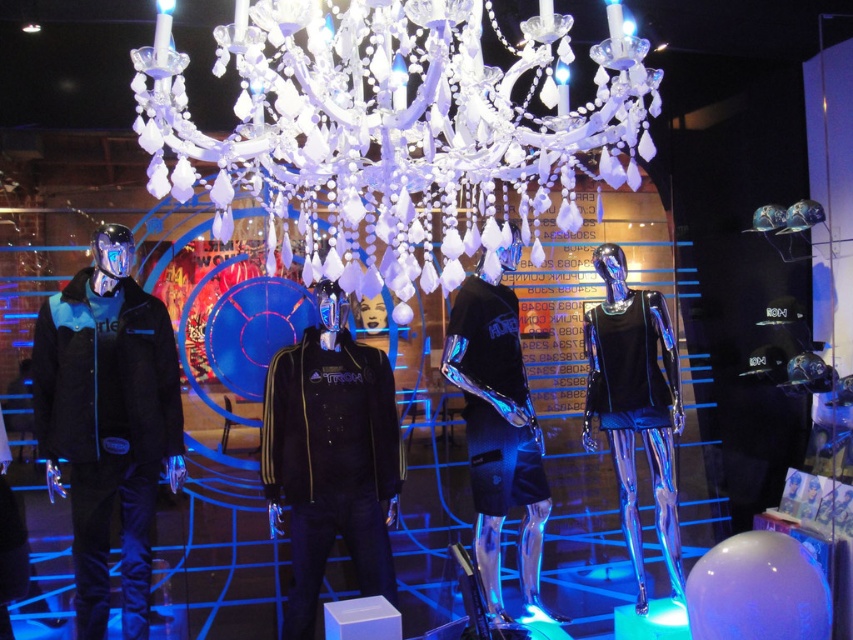
Question: Is matte black jacket at left to the right of black matte jacket at center from the viewer's perspective?

Choices:
 (A) no
 (B) yes

Answer: (A)

Question: Which point is closer to the camera?

Choices:
 (A) (517, 438)
 (B) (366, 250)
 (C) (126, 332)

Answer: (B)

Question: Can you confirm if crystal glass chandelier at upper center is bigger than matte black jacket at left?

Choices:
 (A) yes
 (B) no

Answer: (A)

Question: Does black matte jacket at center have a greater width compared to glossy black shorts at center?

Choices:
 (A) no
 (B) yes

Answer: (B)

Question: Among these points, which one is nearest to the camera?

Choices:
 (A) (341, 465)
 (B) (585, 406)

Answer: (A)

Question: Among these objects, which one is farthest from the camera?

Choices:
 (A) shiny black tank top at center
 (B) glossy black shorts at center
 (C) crystal glass chandelier at upper center
 (D) matte black jacket at left

Answer: (A)